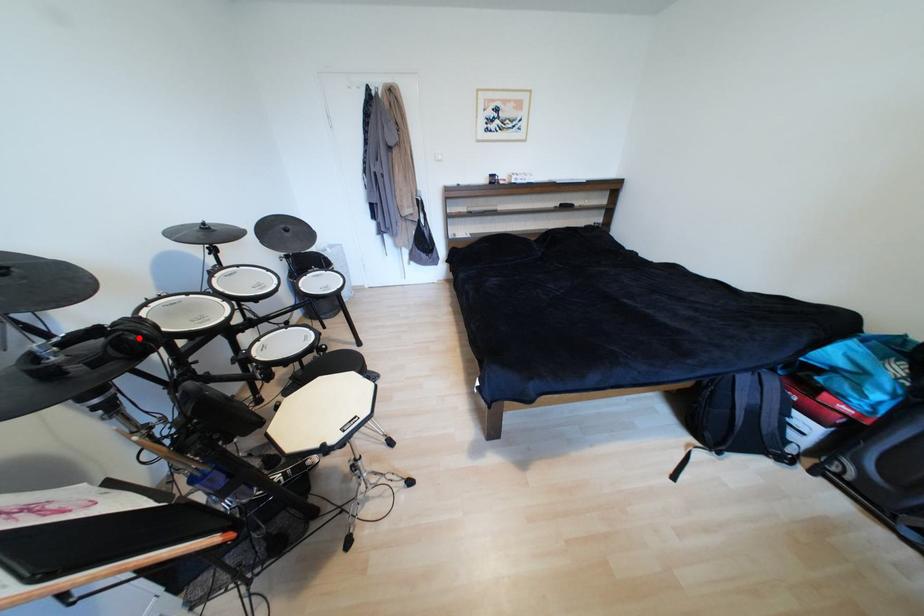
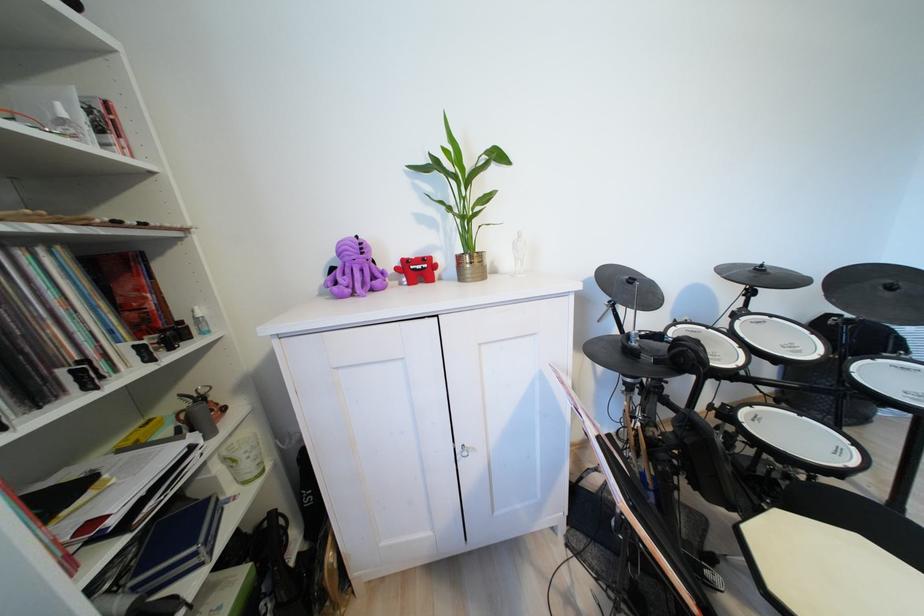
Find the pixel in the second image that matches the highlighted location in the first image.

(699, 357)